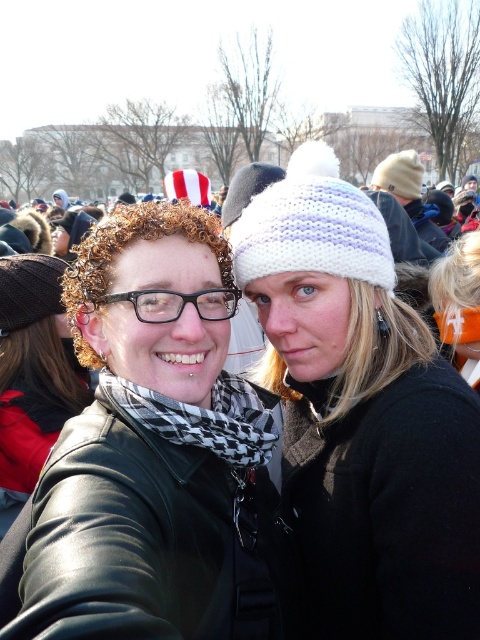
Does matte black jacket at center appear on the right side of black and white checkered scarf at center?

In fact, matte black jacket at center is to the left of black and white checkered scarf at center.

Describe the element at coordinates (33, 372) in the screenshot. This screenshot has height=640, width=480. I see `matte black jacket at center` at that location.

Is point (10, 280) positioned before point (255, 460)?

No, it is not.

The width and height of the screenshot is (480, 640). In order to click on matte black jacket at center in this screenshot , I will do `click(33, 372)`.

Does matte black jacket at center come behind black plastic glasses at center?

Yes, matte black jacket at center is further from the viewer.

Does matte black jacket at center have a larger size compared to black plastic glasses at center?

Yes, matte black jacket at center is bigger than black plastic glasses at center.

Identify the location of matte black jacket at center. (33, 372).

Which is below, blonde hair at center or white knitted hat at upper center?

blonde hair at center is below.

Between blonde hair at center and white knitted hat at upper center, which one has less height?

With less height is blonde hair at center.

The height and width of the screenshot is (640, 480). Identify the location of blonde hair at center. (458, 304).

Where is `blonde hair at center`? blonde hair at center is located at coordinates (458, 304).